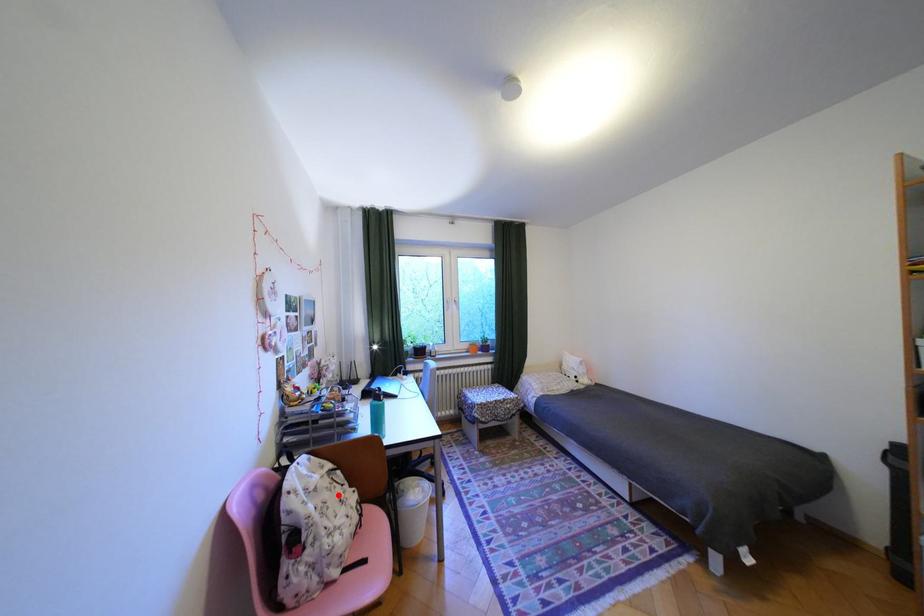
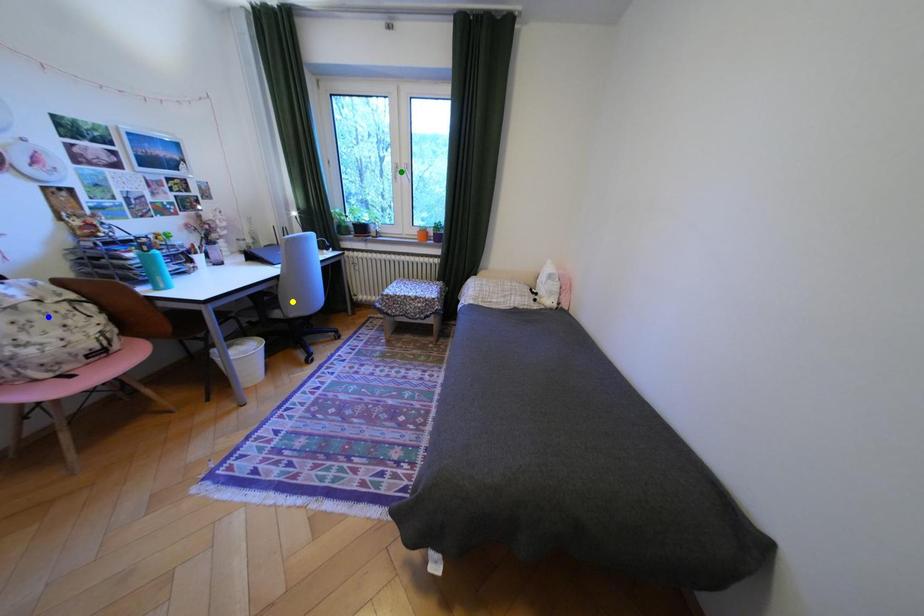
Question: I am providing you with two images of the same scene from different viewpoints. A red point is marked on the first image. You are given multiple points on the second image. In image 2, which mark is for the same physical point as the one in image 1?

Choices:
 (A) blue point
 (B) green point
 (C) yellow point

Answer: (A)